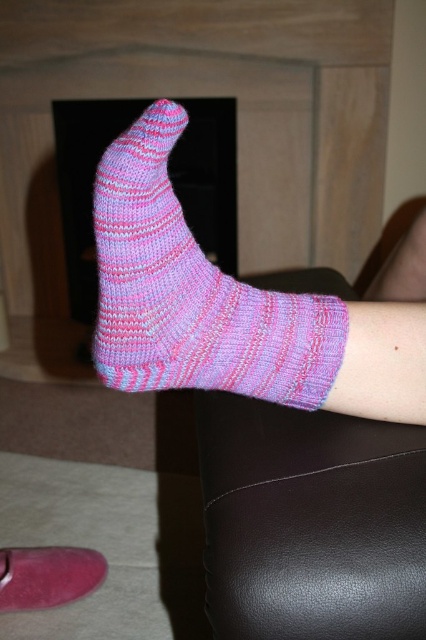
Is pink knitted sock at center below pink knitted sock at lower center?

Actually, pink knitted sock at center is above pink knitted sock at lower center.

Who is shorter, pink knitted sock at center or pink knitted sock at lower center?

With less height is pink knitted sock at lower center.

Who is more distant from viewer, (143, 280) or (39, 547)?

The point (39, 547) is more distant.

Identify the location of pink knitted sock at center. (192, 292).

Is purple knitted sock at lower center bigger than pink knitted sock at lower center?

Correct, purple knitted sock at lower center is larger in size than pink knitted sock at lower center.

Which is more to the left, purple knitted sock at lower center or pink knitted sock at lower center?

pink knitted sock at lower center

Is point (351, 550) positioned behind point (31, 554)?

That is False.

In order to click on purple knitted sock at lower center in this screenshot , I will do pyautogui.click(x=310, y=522).

Does purple knitted sock at lower center appear over pink knitted sock at center?

No, purple knitted sock at lower center is not above pink knitted sock at center.

Between purple knitted sock at lower center and pink knitted sock at center, which one has less height?

With less height is purple knitted sock at lower center.

You are a GUI agent. You are given a task and a screenshot of the screen. Output one action in this format:
    pyautogui.click(x=<x>, y=<y>)
    Task: Click on the purple knitted sock at lower center
    
    Given the screenshot: What is the action you would take?
    pyautogui.click(x=310, y=522)